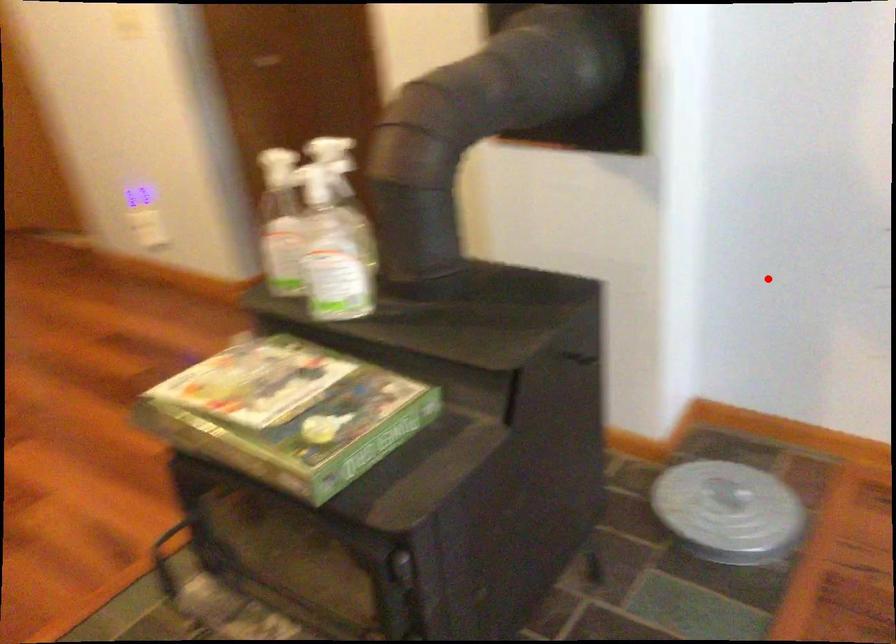
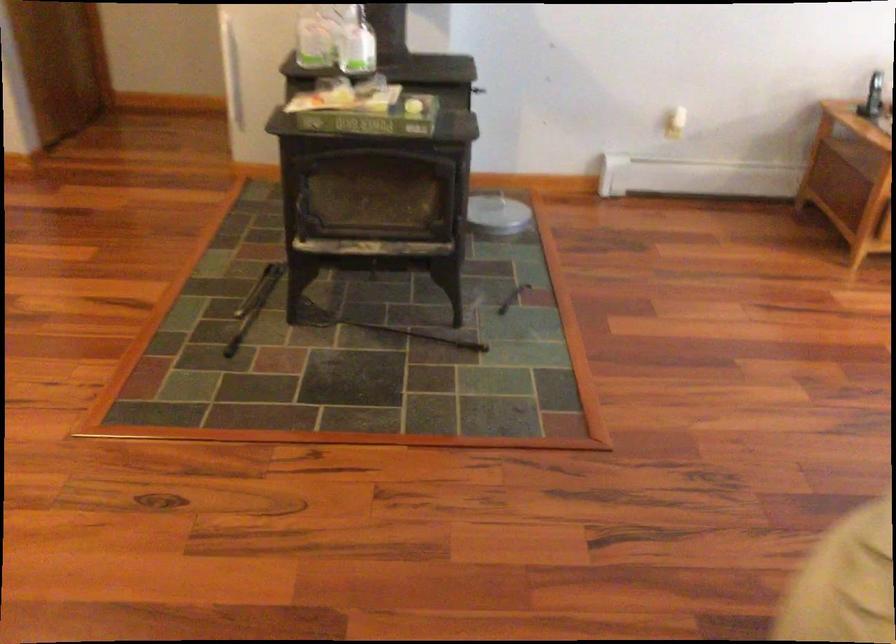
Question: I am providing you with two images of the same scene from different viewpoints. A red point is shown in image1. For the corresponding object point in image2, is it positioned nearer or farther from the camera?

Choices:
 (A) Nearer
 (B) Farther

Answer: (B)